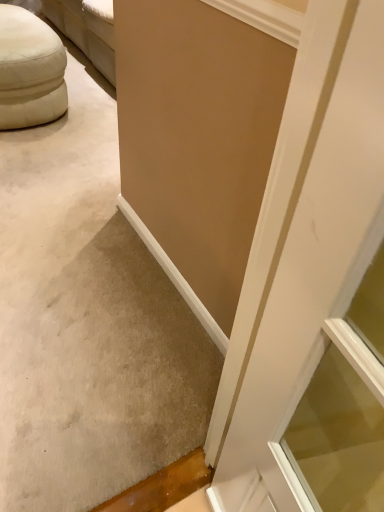
You are a GUI agent. You are given a task and a screenshot of the screen. Output one action in this format:
    pyautogui.click(x=<x>, y=<y>)
    Task: Click on the beige matte wall at upper center
    This screenshot has height=512, width=384.
    Given the screenshot: What is the action you would take?
    pyautogui.click(x=87, y=320)

What do you see at coordinates (87, 320) in the screenshot?
I see `beige matte wall at upper center` at bounding box center [87, 320].

What do you see at coordinates (30, 70) in the screenshot? The width and height of the screenshot is (384, 512). I see `white fabric ottoman at upper left` at bounding box center [30, 70].

Find the location of a particular element. The image size is (384, 512). white fabric ottoman at upper left is located at coordinates (30, 70).

The height and width of the screenshot is (512, 384). Find the location of `beige matte wall at upper center`. beige matte wall at upper center is located at coordinates (87, 320).

Does white fabric ottoman at upper left appear on the left side of beige matte wall at upper center?

Indeed, white fabric ottoman at upper left is positioned on the left side of beige matte wall at upper center.

Which is behind, white fabric ottoman at upper left or beige matte wall at upper center?

white fabric ottoman at upper left is more distant.

Is point (49, 70) closer or farther from the camera than point (141, 273)?

Point (49, 70).

From the image's perspective, relative to beige matte wall at upper center, is white fabric ottoman at upper left above or below?

From the image's perspective, white fabric ottoman at upper left appears above beige matte wall at upper center.

Based on the photo, from a real-world perspective, is white fabric ottoman at upper left physically above beige matte wall at upper center?

Incorrect, from a real-world perspective, white fabric ottoman at upper left is lower than beige matte wall at upper center.

From the picture: Is white fabric ottoman at upper left wider than beige matte wall at upper center?

Yes, white fabric ottoman at upper left is wider than beige matte wall at upper center.

Between white fabric ottoman at upper left and beige matte wall at upper center, which one has less height?

Standing shorter between the two is white fabric ottoman at upper left.

Can you confirm if white fabric ottoman at upper left is smaller than beige matte wall at upper center?

Incorrect, white fabric ottoman at upper left is not smaller in size than beige matte wall at upper center.

Is white fabric ottoman at upper left surrounding beige matte wall at upper center?

That's incorrect, beige matte wall at upper center is not inside white fabric ottoman at upper left.

Based on the photo, are white fabric ottoman at upper left and beige matte wall at upper center making contact?

white fabric ottoman at upper left is not next to beige matte wall at upper center, and they're not touching.

In the scene shown: Is white fabric ottoman at upper left facing away from beige matte wall at upper center?

That's not correct — white fabric ottoman at upper left is not looking away from beige matte wall at upper center.

What's the angular difference between white fabric ottoman at upper left and beige matte wall at upper center's facing directions?

90.4 degrees separate the facing orientations of white fabric ottoman at upper left and beige matte wall at upper center.

What are the coordinates of `concrete in front of the white fabric ottoman at upper left` in the screenshot? It's located at (87, 320).

Is beige matte wall at upper center at the left side of white fabric ottoman at upper left?

In fact, beige matte wall at upper center is to the right of white fabric ottoman at upper left.

Which is behind, beige matte wall at upper center or white fabric ottoman at upper left?

white fabric ottoman at upper left is behind.

Is point (199, 408) less distant than point (56, 42)?

Yes, point (199, 408) is in front of point (56, 42).

From the image's perspective, is beige matte wall at upper center located above white fabric ottoman at upper left?

No, from the image's perspective, beige matte wall at upper center is not on top of white fabric ottoman at upper left.

From a real-world perspective, which is physically below, beige matte wall at upper center or white fabric ottoman at upper left?

In real-world perspective, white fabric ottoman at upper left is lower.

In terms of width, does beige matte wall at upper center look wider or thinner when compared to white fabric ottoman at upper left?

Considering their sizes, beige matte wall at upper center looks slimmer than white fabric ottoman at upper left.

Considering the sizes of objects beige matte wall at upper center and white fabric ottoman at upper left in the image provided, who is shorter, beige matte wall at upper center or white fabric ottoman at upper left?

white fabric ottoman at upper left.

In terms of size, does beige matte wall at upper center appear bigger or smaller than white fabric ottoman at upper left?

Clearly, beige matte wall at upper center is smaller in size than white fabric ottoman at upper left.

Is beige matte wall at upper center not inside white fabric ottoman at upper left?

That's correct, beige matte wall at upper center is outside of white fabric ottoman at upper left.

Is the surface of beige matte wall at upper center in direct contact with white fabric ottoman at upper left?

No, beige matte wall at upper center is not beside white fabric ottoman at upper left.

Looking at this image, is beige matte wall at upper center facing towards white fabric ottoman at upper left?

Yes, beige matte wall at upper center faces towards white fabric ottoman at upper left.

Measure the distance between beige matte wall at upper center and white fabric ottoman at upper left.

beige matte wall at upper center is 27.07 inches away from white fabric ottoman at upper left.

I want to click on concrete that appears in front of the white fabric ottoman at upper left, so click(87, 320).

Find the location of a particular element. furniture located above the beige matte wall at upper center (from the image's perspective) is located at coordinates (30, 70).

What are the coordinates of `furniture located behind the beige matte wall at upper center` in the screenshot? It's located at (30, 70).